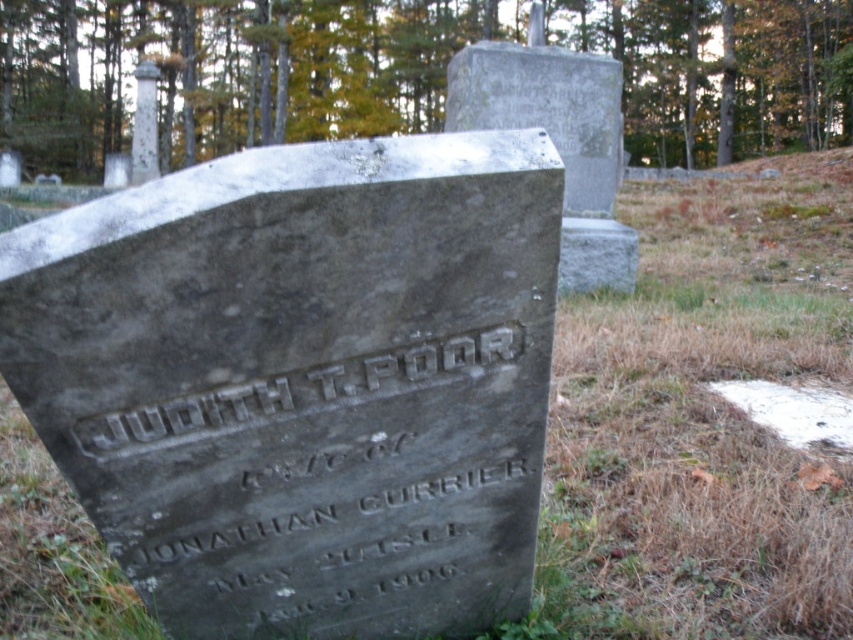
Question: Which of the following is the farthest from the observer?

Choices:
 (A) etched stone nameplate at center
 (B) green leafy tree at upper center

Answer: (B)

Question: Does green leafy tree at upper center have a lesser width compared to etched stone nameplate at center?

Choices:
 (A) yes
 (B) no

Answer: (B)

Question: Is green leafy tree at upper center to the right of etched stone nameplate at center from the viewer's perspective?

Choices:
 (A) yes
 (B) no

Answer: (B)

Question: Which point appears farthest from the camera in this image?

Choices:
 (A) (144, 451)
 (B) (660, 156)

Answer: (B)

Question: Considering the relative positions of green leafy tree at upper center and etched stone nameplate at center in the image provided, where is green leafy tree at upper center located with respect to etched stone nameplate at center?

Choices:
 (A) left
 (B) right

Answer: (A)